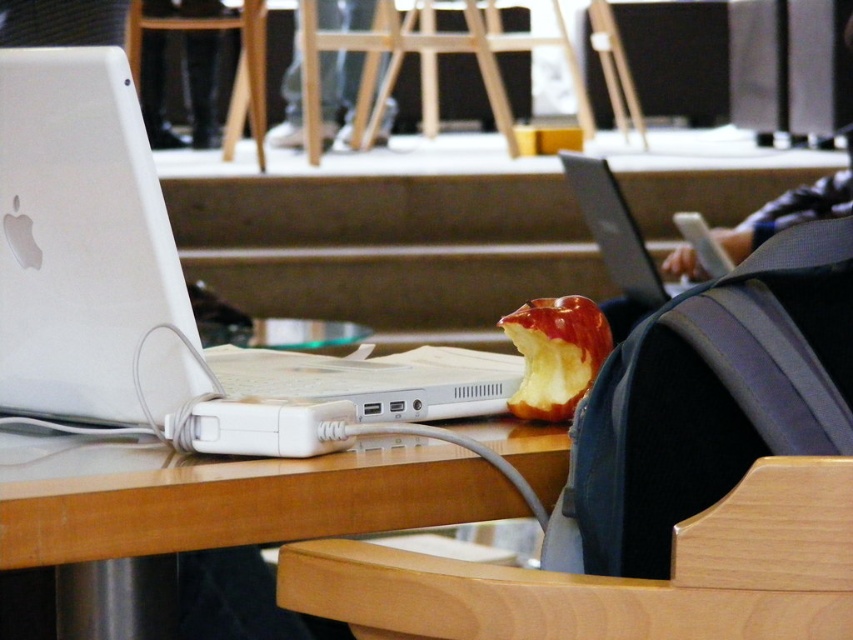
Question: Observing the image, what is the correct spatial positioning of shiny red apple at center in reference to silver metallic laptop at center?

Choices:
 (A) left
 (B) right

Answer: (A)

Question: Which object is closer to the camera taking this photo?

Choices:
 (A) wooden chair at lower center
 (B) dark blue backpack at right

Answer: (A)

Question: Estimate the real-world distances between objects in this image. Which object is closer to the white plastic laptop at left?

Choices:
 (A) silver metallic laptop at center
 (B) wooden table at center
 (C) wooden chair at lower center

Answer: (B)

Question: Considering the relative positions of wooden chair at lower center and shiny red apple at center in the image provided, where is wooden chair at lower center located with respect to shiny red apple at center?

Choices:
 (A) left
 (B) right

Answer: (A)

Question: Considering the real-world distances, which object is closest to the wooden chair at lower center?

Choices:
 (A) shiny red apple at center
 (B) silver metallic laptop at center
 (C) wooden table at center
 (D) white plastic laptop at left

Answer: (C)

Question: Can you confirm if wooden table at center is thinner than silver metallic laptop at center?

Choices:
 (A) yes
 (B) no

Answer: (B)